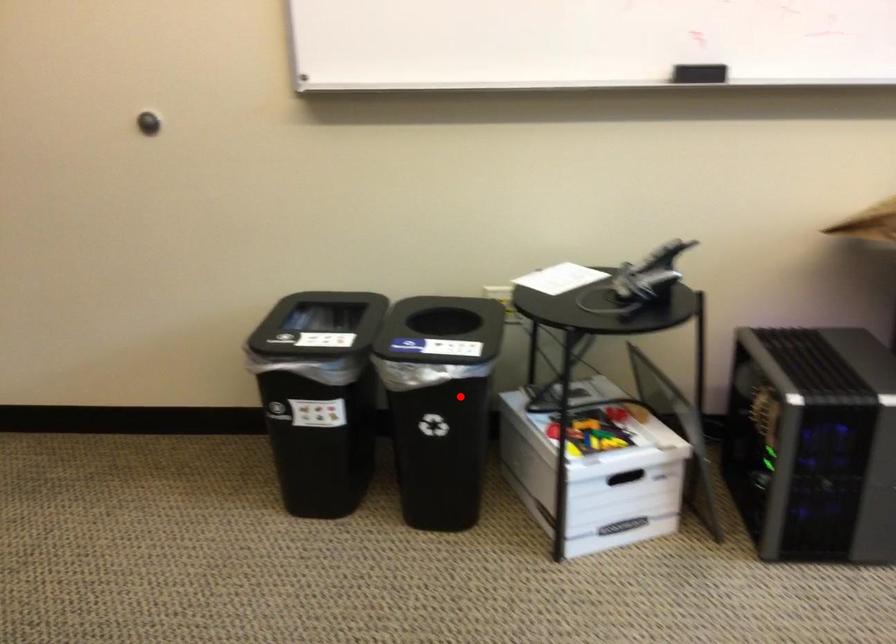
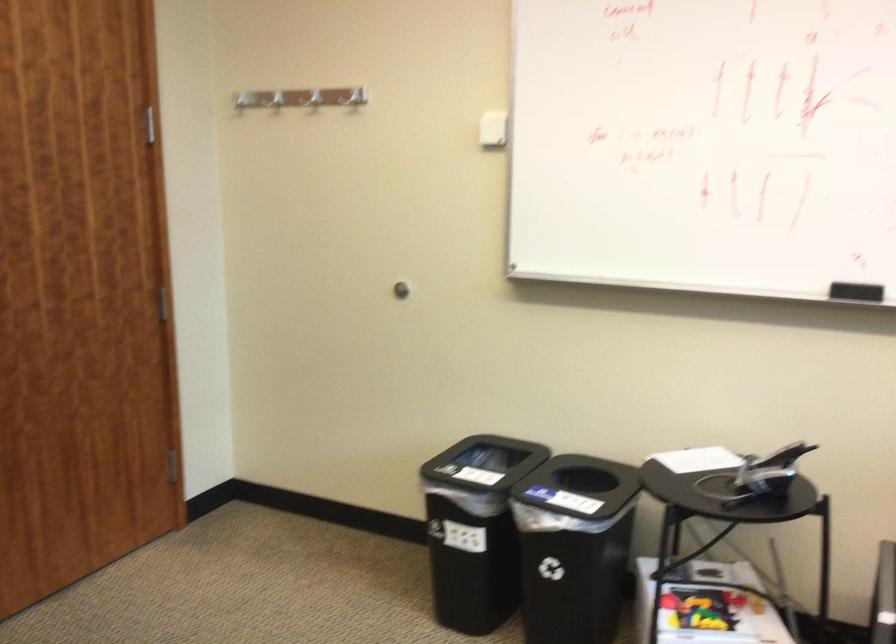
Locate, in the second image, the point that corresponds to the highlighted location in the first image.

(574, 547)